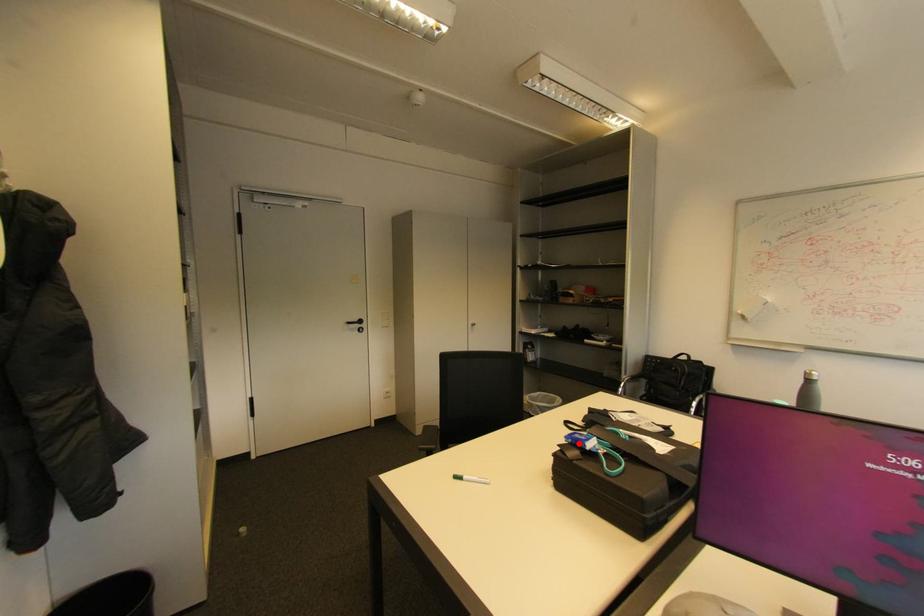
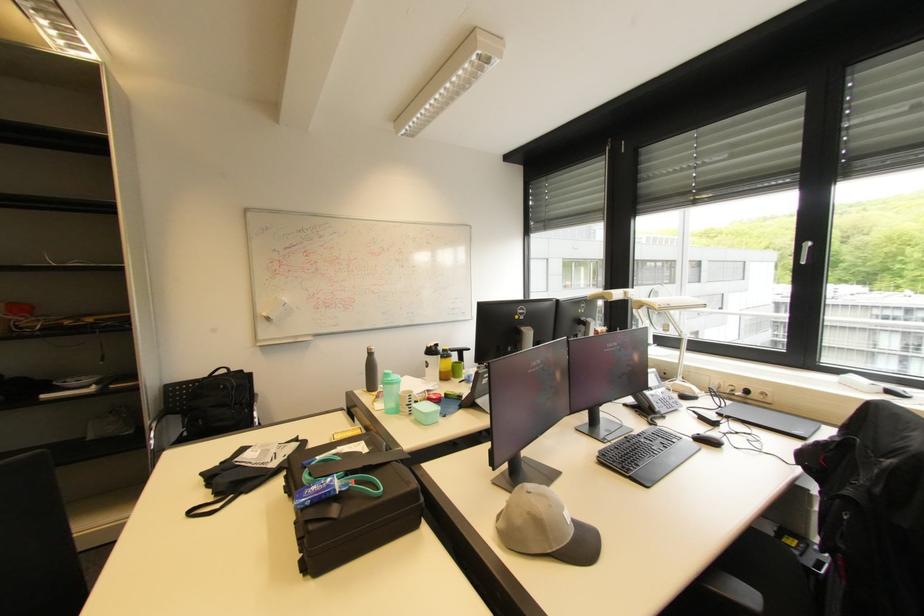
The point at the highlighted location is marked in the first image. Where is the corresponding point in the second image?

(321, 501)